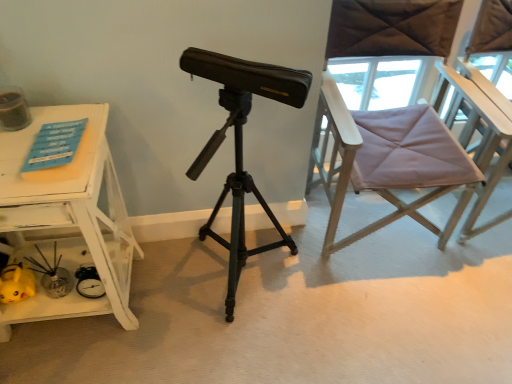
Question: Should I look upward or downward to see purple fabric chair at right?

Choices:
 (A) up
 (B) down

Answer: (A)

Question: Can you confirm if matte black tripod at center is positioned to the left of white painted wood table at left?

Choices:
 (A) yes
 (B) no

Answer: (B)

Question: Can you confirm if matte black tripod at center is positioned to the right of white painted wood table at left?

Choices:
 (A) no
 (B) yes

Answer: (B)

Question: From a real-world perspective, is matte black tripod at center under white painted wood table at left?

Choices:
 (A) yes
 (B) no

Answer: (B)

Question: Does matte black tripod at center have a larger size compared to white painted wood table at left?

Choices:
 (A) yes
 (B) no

Answer: (A)

Question: Is matte black tripod at center not near white painted wood table at left?

Choices:
 (A) yes
 (B) no

Answer: (B)

Question: Considering the relative sizes of matte black tripod at center and white painted wood table at left in the image provided, is matte black tripod at center taller than white painted wood table at left?

Choices:
 (A) yes
 (B) no

Answer: (A)

Question: Is white painted wood table at left positioned with its back to matte black tripod at center?

Choices:
 (A) no
 (B) yes

Answer: (A)

Question: Is white painted wood table at left positioned far away from matte black tripod at center?

Choices:
 (A) no
 (B) yes

Answer: (A)

Question: Does white painted wood table at left lie in front of matte black tripod at center?

Choices:
 (A) no
 (B) yes

Answer: (A)

Question: Is white painted wood table at left to the left of matte black tripod at center from the viewer's perspective?

Choices:
 (A) yes
 (B) no

Answer: (A)

Question: Would you say white painted wood table at left is outside matte black tripod at center?

Choices:
 (A) yes
 (B) no

Answer: (A)

Question: Is white painted wood table at left smaller than matte black tripod at center?

Choices:
 (A) no
 (B) yes

Answer: (B)

Question: From a real-world perspective, is purple fabric chair at right physically below matte black tripod at center?

Choices:
 (A) no
 (B) yes

Answer: (A)